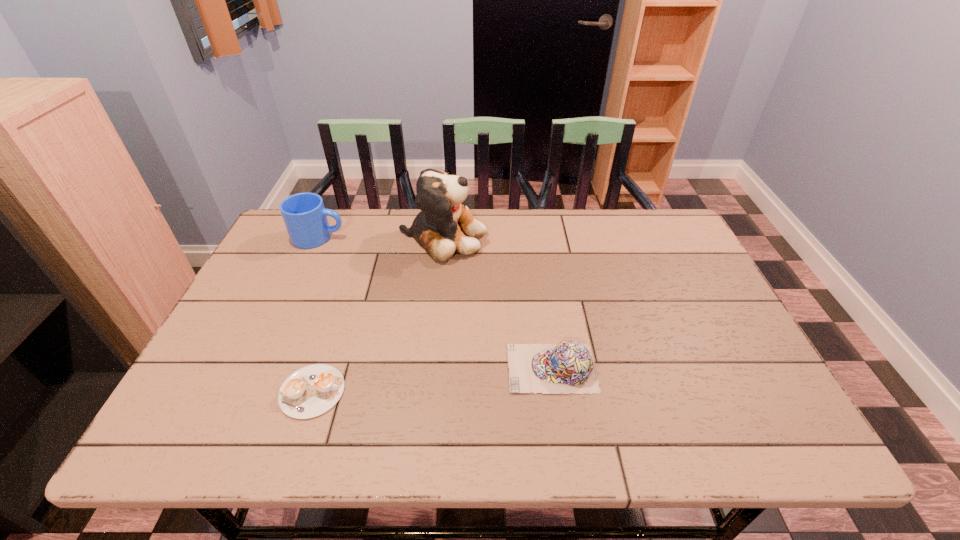
At what (x,y) coordinates should I click in order to perform the action: click on the tallest object. Please return your answer as a coordinate pair (x, y). Looking at the image, I should click on pyautogui.click(x=445, y=225).

The image size is (960, 540). I want to click on puppy, so click(x=445, y=225).

This screenshot has height=540, width=960. In order to click on the third shortest object in this screenshot , I will do `click(305, 217)`.

At what (x,y) coordinates should I click in order to perform the action: click on cap. Please return your answer as a coordinate pair (x, y). Image resolution: width=960 pixels, height=540 pixels. Looking at the image, I should click on (568, 367).

You are a GUI agent. You are given a task and a screenshot of the screen. Output one action in this format:
    pyautogui.click(x=<x>, y=<y>)
    Task: Click on the third tallest object
    The width and height of the screenshot is (960, 540).
    Given the screenshot: What is the action you would take?
    pyautogui.click(x=568, y=367)

Identify the location of the shortest object. (311, 391).

Where is `free space located at the face of the third object from left to right`? The width and height of the screenshot is (960, 540). free space located at the face of the third object from left to right is located at coordinates (610, 238).

Image resolution: width=960 pixels, height=540 pixels. What are the coordinates of `vacant region located 0.110m on the side of the mug with the handle` in the screenshot? It's located at (381, 237).

Locate an element on the screen. The height and width of the screenshot is (540, 960). free region located 0.090m on the front, side, and top of the second shortest object is located at coordinates (468, 368).

This screenshot has width=960, height=540. Identify the location of vacant region located on the front, side, and top of the second shortest object. (394, 368).